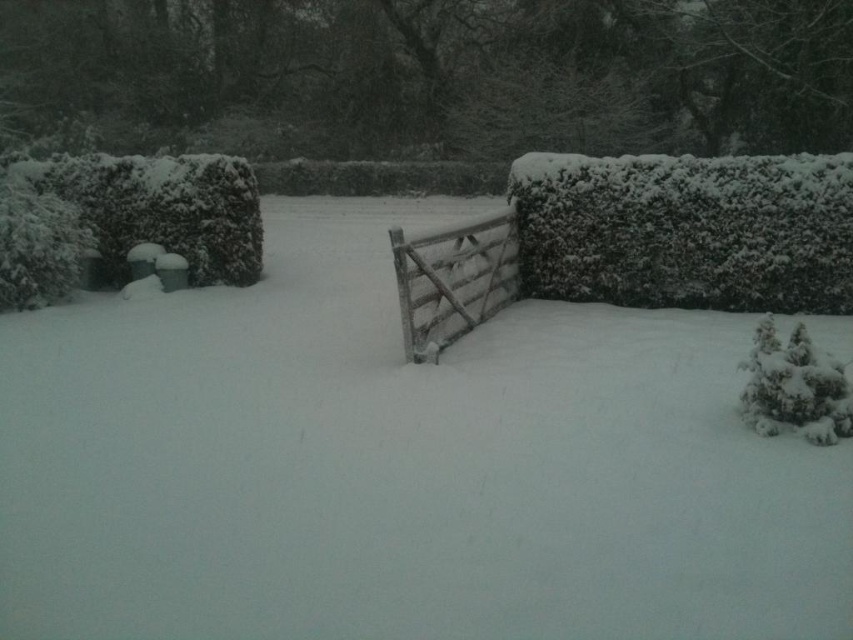
Does snow-covered hedge at right appear on the left side of snow-covered bush at lower right?

In fact, snow-covered hedge at right is to the right of snow-covered bush at lower right.

Can you confirm if snow-covered hedge at right is smaller than snow-covered bush at lower right?

No.

Between point (764, 269) and point (831, 412), which one is positioned in front?

Point (831, 412) is in front.

This screenshot has height=640, width=853. Find the location of `snow-covered hedge at right`. snow-covered hedge at right is located at coordinates (688, 230).

Based on the photo, which is below, snow-covered hedge at right or wooden gate at center?

wooden gate at center is below.

Which of these two, snow-covered hedge at right or wooden gate at center, stands taller?

snow-covered hedge at right is taller.

Is point (724, 275) positioned after point (393, 266)?

Yes, it is.

Where is `snow-covered hedge at right`? The height and width of the screenshot is (640, 853). snow-covered hedge at right is located at coordinates (688, 230).

Is wooden gate at center to the left of snow-covered bush at lower right from the viewer's perspective?

Indeed, wooden gate at center is positioned on the left side of snow-covered bush at lower right.

The image size is (853, 640). What do you see at coordinates (453, 280) in the screenshot? I see `wooden gate at center` at bounding box center [453, 280].

Identify the location of wooden gate at center. The image size is (853, 640). (453, 280).